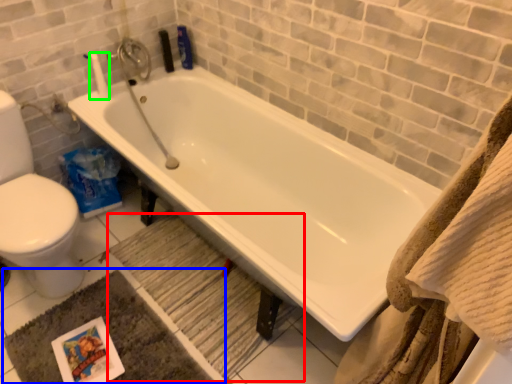
Question: Considering the real-world distances, which object is closest to bath mat (highlighted by a red box)? bath mat (highlighted by a blue box) or toilet paper (highlighted by a green box).

Choices:
 (A) bath mat
 (B) toilet paper

Answer: (A)